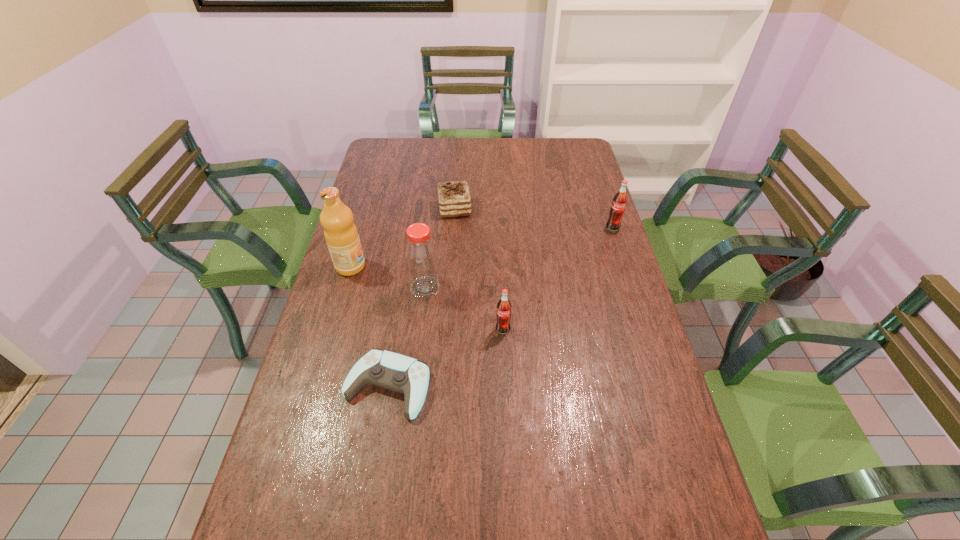
Find the location of a particular element. This screenshot has height=540, width=960. the shortest object is located at coordinates (396, 372).

Find the location of `blank space located 0.070m on the label of the left soda bottle`. blank space located 0.070m on the label of the left soda bottle is located at coordinates (504, 355).

Locate an element on the screen. This screenshot has height=540, width=960. free space located 0.160m on the left of the farthest object is located at coordinates (395, 209).

At what (x,y) coordinates should I click in order to perform the action: click on vacant point located 0.130m on the left of the bottle. Please return your answer as a coordinate pair (x, y). The height and width of the screenshot is (540, 960). Looking at the image, I should click on (368, 288).

This screenshot has width=960, height=540. Find the location of `vacant space situated on the front label of the tallest object`. vacant space situated on the front label of the tallest object is located at coordinates (381, 266).

Where is `vacant space located 0.270m on the right of the control`? The width and height of the screenshot is (960, 540). vacant space located 0.270m on the right of the control is located at coordinates (535, 386).

Locate an element on the screen. The height and width of the screenshot is (540, 960). fruit juice that is at the left edge is located at coordinates (341, 235).

Find the location of `control at the left edge`. control at the left edge is located at coordinates (396, 372).

Image resolution: width=960 pixels, height=540 pixels. I want to click on object present at the right edge, so click(x=617, y=209).

Identify the location of free space at the far edge of the desktop. The width and height of the screenshot is (960, 540). (466, 158).